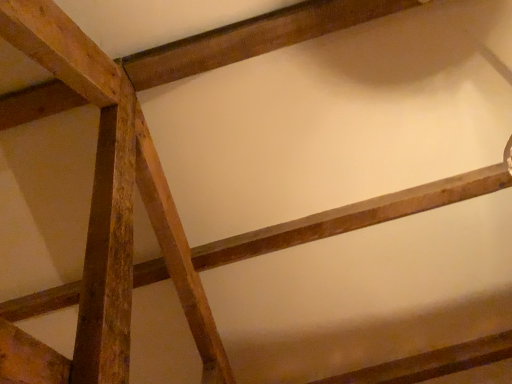
Question: Should I look upward or downward to see smooth wooden plank at upper center?

Choices:
 (A) up
 (B) down

Answer: (A)